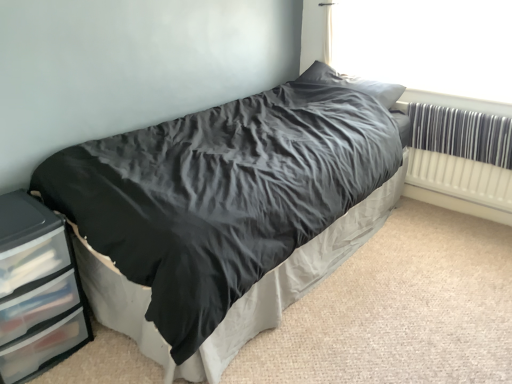
This screenshot has width=512, height=384. What do you see at coordinates (36, 289) in the screenshot? I see `clear plastic chest of drawers at lower left` at bounding box center [36, 289].

The image size is (512, 384). Describe the element at coordinates (461, 154) in the screenshot. I see `white plastic radiator at right` at that location.

The image size is (512, 384). Identify the location of white plastic radiator at right. (461, 154).

What is the approximate height of transparent plastic window screen at upper right?

transparent plastic window screen at upper right is 20.42 inches in height.

This screenshot has height=384, width=512. What are the coordinates of `satin gray pillow at upper center` in the screenshot? It's located at (352, 83).

Does clear plastic chest of drawers at lower left come in front of white plastic radiator at right?

That is True.

In the image, there is a clear plastic chest of drawers at lower left. Identify the location of radiator above it (from the image's perspective). [461, 154].

From the image's perspective, which one is positioned higher, clear plastic chest of drawers at lower left or white plastic radiator at right?

white plastic radiator at right is shown above in the image.

Is clear plastic chest of drawers at lower left situated inside white plastic radiator at right or outside?

clear plastic chest of drawers at lower left lies outside white plastic radiator at right.

From the image's perspective, between satin gray pillow at upper center and clear plastic chest of drawers at lower left, who is located below?

clear plastic chest of drawers at lower left, from the image's perspective.

What's the angular difference between satin gray pillow at upper center and clear plastic chest of drawers at lower left's facing directions?

The facing directions of satin gray pillow at upper center and clear plastic chest of drawers at lower left are 87.8 degrees apart.

In the scene shown: Is satin gray pillow at upper center oriented away from clear plastic chest of drawers at lower left?

No.

Considering the positions of point (315, 82) and point (5, 277), is point (315, 82) closer or farther from the camera than point (5, 277)?

Point (315, 82) appears to be farther away from the viewer than point (5, 277).

Is white plastic radiator at right with clear plastic chest of drawers at lower left?

white plastic radiator at right and clear plastic chest of drawers at lower left are clearly separated.

Is white plastic radiator at right positioned behind clear plastic chest of drawers at lower left?

Yes, white plastic radiator at right is further from the viewer.

Measure the distance from white plastic radiator at right to clear plastic chest of drawers at lower left.

They are 2.23 meters apart.

Based on the photo, considering the sizes of objects white plastic radiator at right and clear plastic chest of drawers at lower left in the image provided, who is smaller, white plastic radiator at right or clear plastic chest of drawers at lower left?

Smaller between the two is white plastic radiator at right.

Can you confirm if clear plastic chest of drawers at lower left is bigger than transparent plastic window screen at upper right?

Indeed, clear plastic chest of drawers at lower left has a larger size compared to transparent plastic window screen at upper right.

Is clear plastic chest of drawers at lower left aimed at transparent plastic window screen at upper right?

No, clear plastic chest of drawers at lower left is not aimed at transparent plastic window screen at upper right.

Is the depth of clear plastic chest of drawers at lower left less than that of transparent plastic window screen at upper right?

Yes, clear plastic chest of drawers at lower left is closer to the camera.

Would you say clear plastic chest of drawers at lower left is outside transparent plastic window screen at upper right?

Yes.

Is white plastic radiator at right oriented away from matte black bed at center?

No, white plastic radiator at right's orientation is not away from matte black bed at center.

Can you confirm if white plastic radiator at right is positioned to the right of matte black bed at center?

Indeed, white plastic radiator at right is positioned on the right side of matte black bed at center.

Could you measure the distance between satin gray pillow at upper center and transparent plastic window screen at upper right?

They are 15.44 inches apart.

Considering the sizes of objects satin gray pillow at upper center and transparent plastic window screen at upper right in the image provided, who is thinner, satin gray pillow at upper center or transparent plastic window screen at upper right?

transparent plastic window screen at upper right is thinner.

Looking at this image, is satin gray pillow at upper center further to the viewer compared to transparent plastic window screen at upper right?

Yes, satin gray pillow at upper center is behind transparent plastic window screen at upper right.

Is satin gray pillow at upper center surrounding transparent plastic window screen at upper right?

No, satin gray pillow at upper center does not contain transparent plastic window screen at upper right.

From a real-world perspective, which object rests below the other?

clear plastic chest of drawers at lower left.

Is the position of transparent plastic window screen at upper right less distant than that of clear plastic chest of drawers at lower left?

No, the depth of transparent plastic window screen at upper right is greater than that of clear plastic chest of drawers at lower left.

Is transparent plastic window screen at upper right to the left of clear plastic chest of drawers at lower left from the viewer's perspective?

Incorrect, transparent plastic window screen at upper right is not on the left side of clear plastic chest of drawers at lower left.

Is point (500, 8) farther from viewer compared to point (39, 270)?

Yes, it is.

The height and width of the screenshot is (384, 512). In order to click on chest of drawers below the white plastic radiator at right (from the image's perspective) in this screenshot , I will do `click(36, 289)`.

Where is `the chest of drawers that appears in front of the satin gray pillow at upper center`? The image size is (512, 384). the chest of drawers that appears in front of the satin gray pillow at upper center is located at coordinates (36, 289).

Based on their spatial positions, is white plastic radiator at right or matte black bed at center further from transparent plastic window screen at upper right?

matte black bed at center.

Estimate the real-world distances between objects in this image. Which object is closer to clear plastic chest of drawers at lower left, white plastic radiator at right or transparent plastic window screen at upper right?

Based on the image, white plastic radiator at right appears to be nearer to clear plastic chest of drawers at lower left.

Considering their positions, is clear plastic chest of drawers at lower left positioned further to transparent plastic window screen at upper right than matte black bed at center?

Among the two, clear plastic chest of drawers at lower left is located further to transparent plastic window screen at upper right.

Looking at the image, which one is located closer to clear plastic chest of drawers at lower left, transparent plastic window screen at upper right or matte black bed at center?

matte black bed at center.

Estimate the real-world distances between objects in this image. Which object is closer to clear plastic chest of drawers at lower left, matte black bed at center or satin gray pillow at upper center?

matte black bed at center lies closer to clear plastic chest of drawers at lower left than the other object.

Estimate the real-world distances between objects in this image. Which object is closer to clear plastic chest of drawers at lower left, transparent plastic window screen at upper right or satin gray pillow at upper center?

Based on the image, satin gray pillow at upper center appears to be nearer to clear plastic chest of drawers at lower left.

Which object lies further to the anchor point satin gray pillow at upper center, white plastic radiator at right or transparent plastic window screen at upper right?

Based on the image, white plastic radiator at right appears to be further to satin gray pillow at upper center.

Looking at the image, which one is located further to satin gray pillow at upper center, clear plastic chest of drawers at lower left or white plastic radiator at right?

Among the two, clear plastic chest of drawers at lower left is located further to satin gray pillow at upper center.

Image resolution: width=512 pixels, height=384 pixels. In order to click on pillow situated between clear plastic chest of drawers at lower left and transparent plastic window screen at upper right from left to right in this screenshot , I will do `click(352, 83)`.

What are the coordinates of `radiator positioned between matte black bed at center and satin gray pillow at upper center from near to far` in the screenshot? It's located at (461, 154).

Locate an element on the screen. Image resolution: width=512 pixels, height=384 pixels. bed between clear plastic chest of drawers at lower left and transparent plastic window screen at upper right from left to right is located at coordinates (224, 215).

At what (x,y) coordinates should I click in order to perform the action: click on bed located between clear plastic chest of drawers at lower left and white plastic radiator at right in the left-right direction. Please return your answer as a coordinate pair (x, y). Looking at the image, I should click on (224, 215).